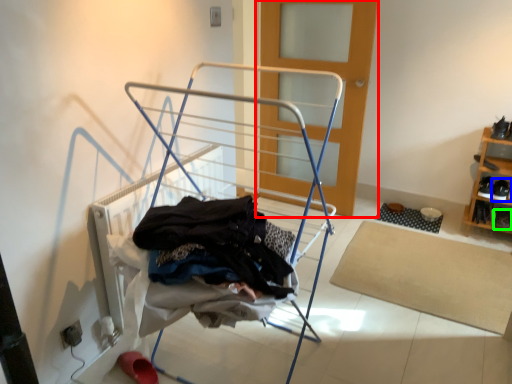
Question: Which object is positioned closest to door (highlighted by a red box)? Select from footwear (highlighted by a blue box) and shoe (highlighted by a green box).

Choices:
 (A) footwear
 (B) shoe

Answer: (A)